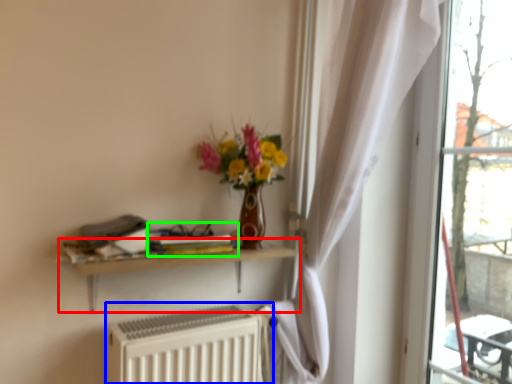
Question: Considering the real-world distances, which object is farthest from shelf (highlighted by a red box)? radiator (highlighted by a blue box) or book (highlighted by a green box)?

Choices:
 (A) radiator
 (B) book

Answer: (A)